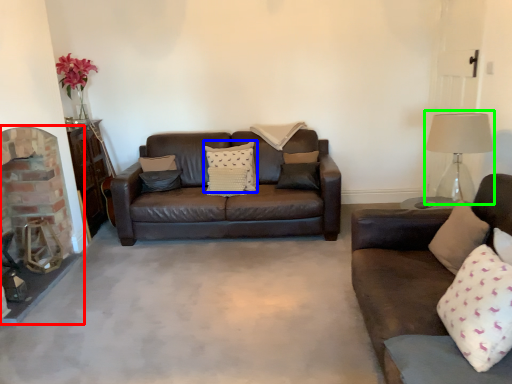
Question: Which object is positioned farthest from fireplace (highlighted by a red box)? Select from pillow (highlighted by a blue box) and table lamp (highlighted by a green box).

Choices:
 (A) pillow
 (B) table lamp

Answer: (B)